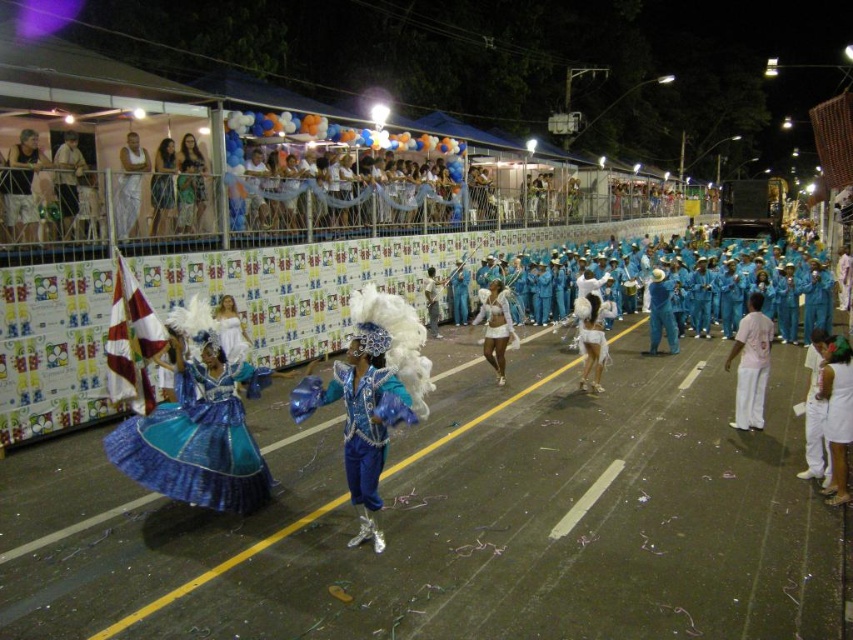
Does pink fabric pants at right come in front of matte white shirt at upper left?

Yes, pink fabric pants at right is in front of matte white shirt at upper left.

Is point (747, 396) positioned after point (74, 182)?

No, it is in front of (74, 182).

This screenshot has width=853, height=640. Find the location of `pink fabric pants at right`. pink fabric pants at right is located at coordinates (750, 364).

The height and width of the screenshot is (640, 853). Identify the location of blue satin costume at center. (372, 394).

Who is higher up, blue satin costume at center or matte white shirt at upper left?

matte white shirt at upper left is higher up.

Who is more distant from viewer, (378, 465) or (59, 182)?

The point (59, 182) is behind.

Locate an element on the screen. This screenshot has width=853, height=640. blue satin costume at center is located at coordinates (372, 394).

Does blue satin dress at center appear on the right side of white cotton dress at upper left?

Correct, you'll find blue satin dress at center to the right of white cotton dress at upper left.

Does blue satin dress at center have a greater width compared to white cotton dress at upper left?

Yes, blue satin dress at center is wider than white cotton dress at upper left.

Find the location of a particular element. The height and width of the screenshot is (640, 853). blue satin dress at center is located at coordinates (198, 440).